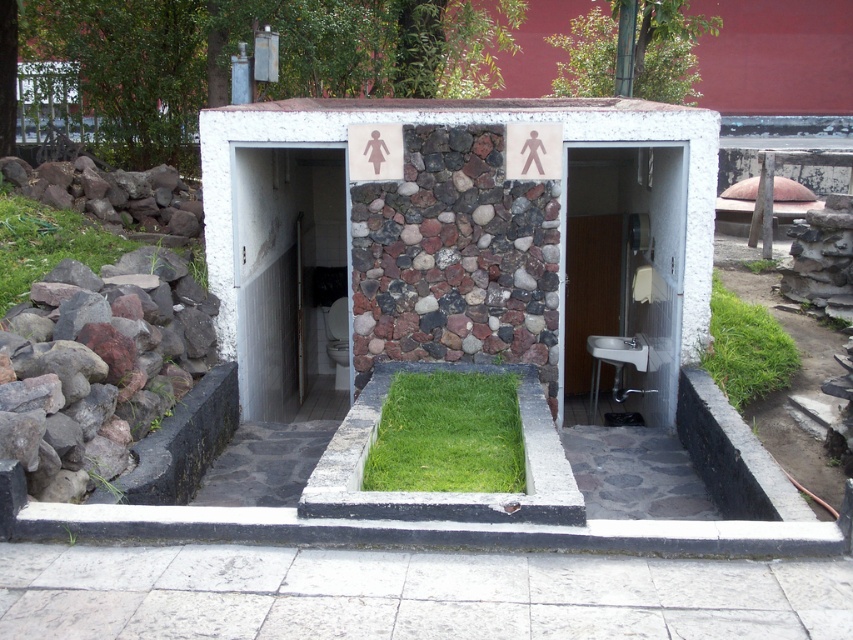
Question: Is green grass at lower left to the left of green grass at lower right from the viewer's perspective?

Choices:
 (A) no
 (B) yes

Answer: (B)

Question: Among these points, which one is nearest to the camera?

Choices:
 (A) (173, 356)
 (B) (164, 177)
 (C) (299, 268)
 (D) (670, 257)

Answer: (A)

Question: Which of the following is the farthest from the observer?

Choices:
 (A) (743, 312)
 (B) (654, 420)
 (C) (416, 435)
 (D) (161, 259)

Answer: (A)

Question: Which point is closer to the camera?

Choices:
 (A) (22, 262)
 (B) (416, 394)
 (C) (258, 168)

Answer: (B)

Question: Is white glossy door at center smaller than green grass at lower left?

Choices:
 (A) yes
 (B) no

Answer: (B)

Question: Where is gray rock at lower left located in relation to white glossy door at center in the image?

Choices:
 (A) above
 (B) below

Answer: (B)